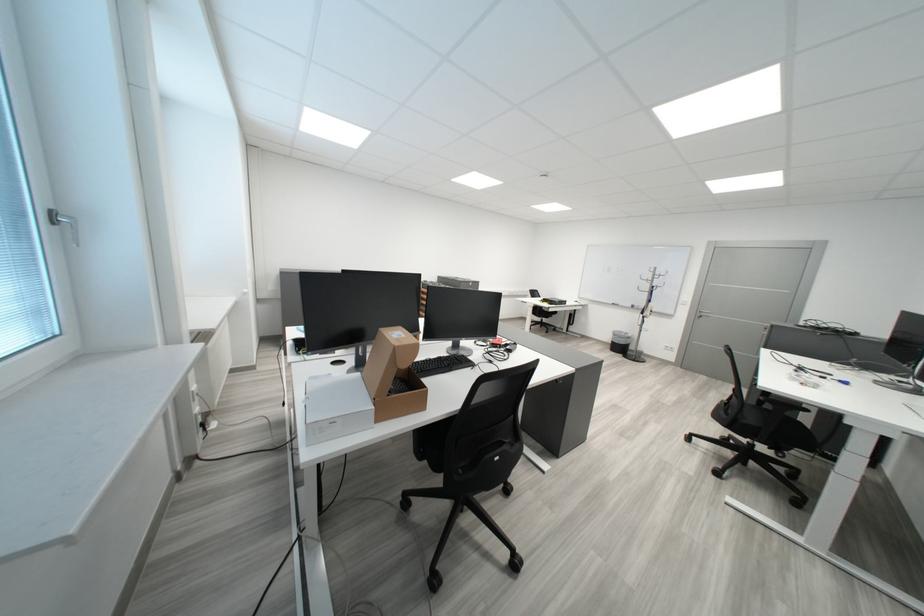
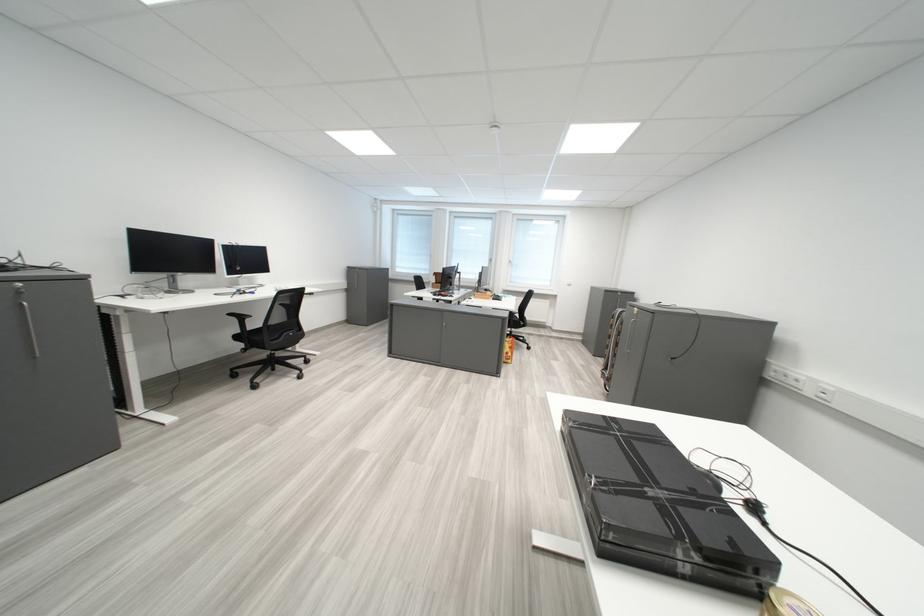
Question: I am providing you with two images of the same scene from different viewpoints. Which of the following objects are not visible in image2?

Choices:
 (A) small gold container
 (B) white round clock
 (C) black taped box
 (D) black computer mouse

Answer: (D)